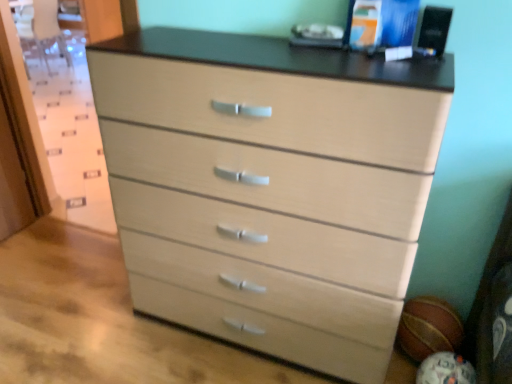
Question: Should I look upward or downward to see light wood/texture chest of drawers at center?

Choices:
 (A) down
 (B) up

Answer: (A)

Question: Considering the relative sizes of matte brown basketball at lower right, the 2th basketball positioned from the back, and rubber textured basketball at lower right, which is the first basketball from back to front, in the image provided, is matte brown basketball at lower right, the 2th basketball positioned from the back, shorter than rubber textured basketball at lower right, which is the first basketball from back to front,?

Choices:
 (A) no
 (B) yes

Answer: (A)

Question: Does matte brown basketball at lower right, the first basketball in the front-to-back sequence, have a greater width compared to rubber textured basketball at lower right, which is counted as the second basketball, starting from the front?

Choices:
 (A) yes
 (B) no

Answer: (A)

Question: From a real-world perspective, is matte brown basketball at lower right, the 2th basketball positioned from the back, physically above rubber textured basketball at lower right, which is counted as the second basketball, starting from the front?

Choices:
 (A) no
 (B) yes

Answer: (A)

Question: Is rubber textured basketball at lower right, which is the first basketball from back to front, completely or partially inside matte brown basketball at lower right, the first basketball in the front-to-back sequence?

Choices:
 (A) no
 (B) yes

Answer: (A)

Question: Does matte brown basketball at lower right, the first basketball in the front-to-back sequence, have a smaller size compared to rubber textured basketball at lower right, which is the first basketball from back to front?

Choices:
 (A) no
 (B) yes

Answer: (B)

Question: From the image's perspective, is matte brown basketball at lower right, the 2th basketball positioned from the back, under rubber textured basketball at lower right, which is the first basketball from back to front?

Choices:
 (A) no
 (B) yes

Answer: (B)

Question: From the image's perspective, is rubber textured basketball at lower right, which is the first basketball from back to front, on top of light wood/texture chest of drawers at center?

Choices:
 (A) no
 (B) yes

Answer: (A)

Question: Are rubber textured basketball at lower right, which is the first basketball from back to front, and light wood/texture chest of drawers at center far apart?

Choices:
 (A) yes
 (B) no

Answer: (B)

Question: Can you confirm if rubber textured basketball at lower right, which is the first basketball from back to front, is wider than light wood/texture chest of drawers at center?

Choices:
 (A) no
 (B) yes

Answer: (A)

Question: Would you say rubber textured basketball at lower right, which is the first basketball from back to front, is outside light wood/texture chest of drawers at center?

Choices:
 (A) yes
 (B) no

Answer: (A)

Question: Is the depth of rubber textured basketball at lower right, which is counted as the second basketball, starting from the front, greater than that of light wood/texture chest of drawers at center?

Choices:
 (A) no
 (B) yes

Answer: (B)

Question: Is rubber textured basketball at lower right, which is the first basketball from back to front, bigger than light wood/texture chest of drawers at center?

Choices:
 (A) yes
 (B) no

Answer: (B)

Question: Can you confirm if light wood/texture chest of drawers at center is positioned to the right of matte brown basketball at lower right, the 2th basketball positioned from the back?

Choices:
 (A) no
 (B) yes

Answer: (A)